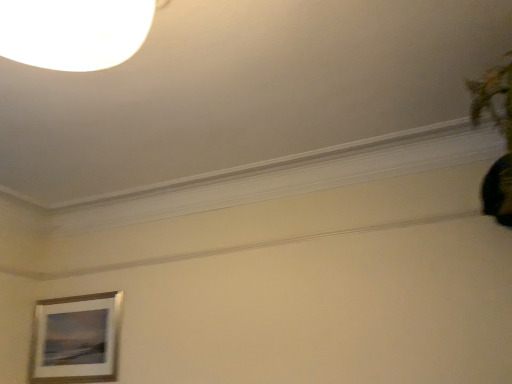
Question: Can you confirm if green leafy plant at upper right is bigger than wooden frame at lower left?

Choices:
 (A) no
 (B) yes

Answer: (B)

Question: Does green leafy plant at upper right appear on the left side of wooden frame at lower left?

Choices:
 (A) yes
 (B) no

Answer: (B)

Question: Is wooden frame at lower left inside green leafy plant at upper right?

Choices:
 (A) yes
 (B) no

Answer: (B)

Question: From a real-world perspective, is green leafy plant at upper right positioned under wooden frame at lower left based on gravity?

Choices:
 (A) yes
 (B) no

Answer: (B)

Question: From the image's perspective, is green leafy plant at upper right over wooden frame at lower left?

Choices:
 (A) no
 (B) yes

Answer: (B)

Question: Is green leafy plant at upper right closer to camera compared to wooden frame at lower left?

Choices:
 (A) no
 (B) yes

Answer: (B)

Question: Is wooden frame at lower left outside green leafy plant at upper right?

Choices:
 (A) yes
 (B) no

Answer: (A)

Question: Does wooden frame at lower left appear on the left side of green leafy plant at upper right?

Choices:
 (A) no
 (B) yes

Answer: (B)

Question: From the image's perspective, is wooden frame at lower left on top of green leafy plant at upper right?

Choices:
 (A) yes
 (B) no

Answer: (B)

Question: From a real-world perspective, is wooden frame at lower left beneath green leafy plant at upper right?

Choices:
 (A) no
 (B) yes

Answer: (B)

Question: Is wooden frame at lower left not close to green leafy plant at upper right?

Choices:
 (A) yes
 (B) no

Answer: (A)

Question: Is green leafy plant at upper right at the back of wooden frame at lower left?

Choices:
 (A) yes
 (B) no

Answer: (B)

Question: Considering their positions, is wooden frame at lower left located in front of or behind green leafy plant at upper right?

Choices:
 (A) behind
 (B) front

Answer: (A)